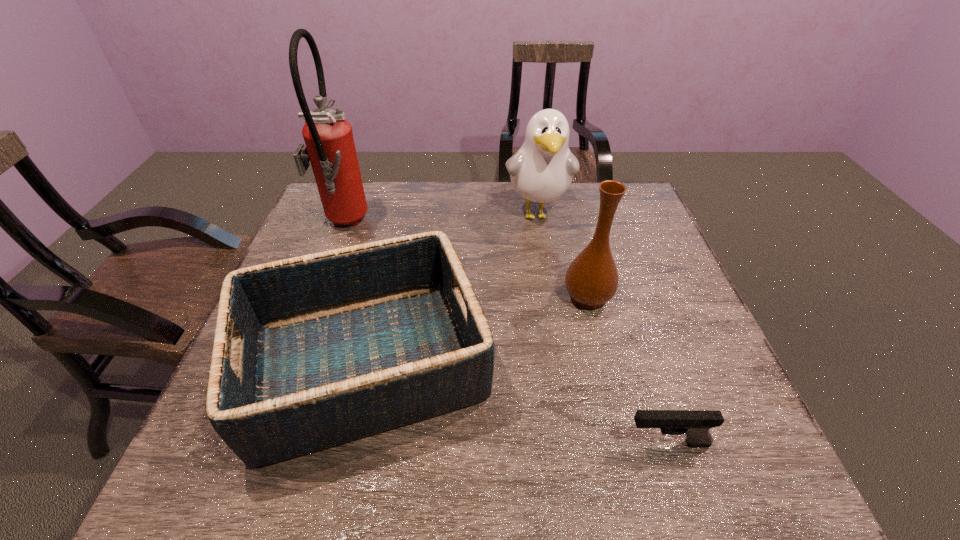
The width and height of the screenshot is (960, 540). I want to click on free spot that satisfies the following two spatial constraints: 1. on the beak of the gull; 2. at the nozzle of the tallest object, so click(540, 225).

I want to click on free spot that satisfies the following two spatial constraints: 1. at the nozzle of the vase; 2. on the left side of the tallest object, so click(315, 298).

Identify the location of free spot that satisfies the following two spatial constraints: 1. on the back side of the vase; 2. on the left side of the basket. (380, 298).